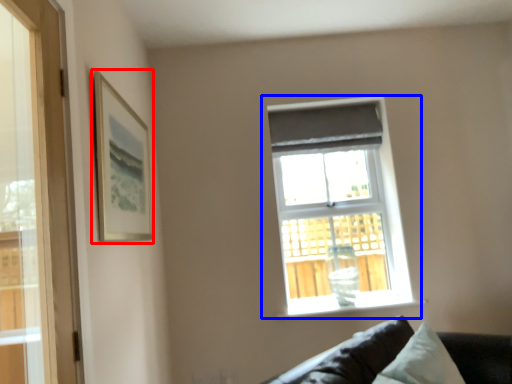
Question: Among these objects, which one is nearest to the camera, picture frame (highlighted by a red box) or window (highlighted by a blue box)?

Choices:
 (A) picture frame
 (B) window

Answer: (A)